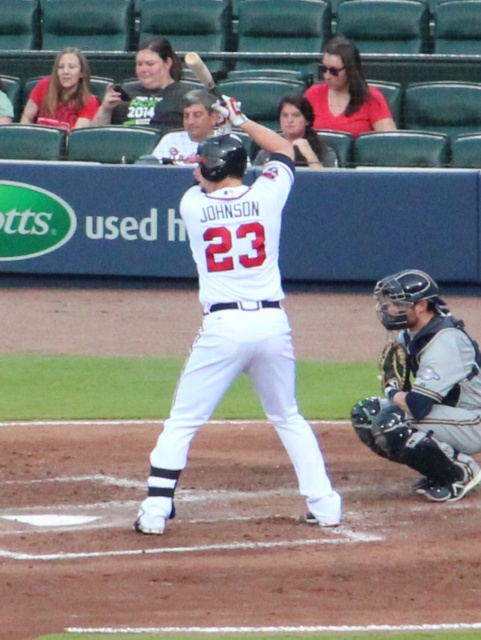
Question: Which of the following is the closest to the observer?

Choices:
 (A) black leather glove at lower right
 (B) wooden baseball bat at upper center
 (C) white matte uniform at center
 (D) gray matte catcher at lower right

Answer: (C)

Question: Is black leather glove at lower right smaller than leather textured glove at lower right?

Choices:
 (A) yes
 (B) no

Answer: (B)

Question: Does white matte uniform at center have a larger size compared to wooden baseball bat at upper center?

Choices:
 (A) yes
 (B) no

Answer: (B)

Question: Which of the following is the farthest from the observer?

Choices:
 (A) (379, 368)
 (B) (141, 506)
 (C) (216, 92)

Answer: (A)

Question: Which of these objects is positioned farthest from the white matte uniform at center?

Choices:
 (A) smooth skin face at upper center
 (B) wooden baseball bat at upper center
 (C) gray matte catcher at lower right
 (D) black leather glove at lower right

Answer: (A)

Question: Can you confirm if white matte uniform at center is positioned to the right of leather textured glove at lower right?

Choices:
 (A) no
 (B) yes

Answer: (A)